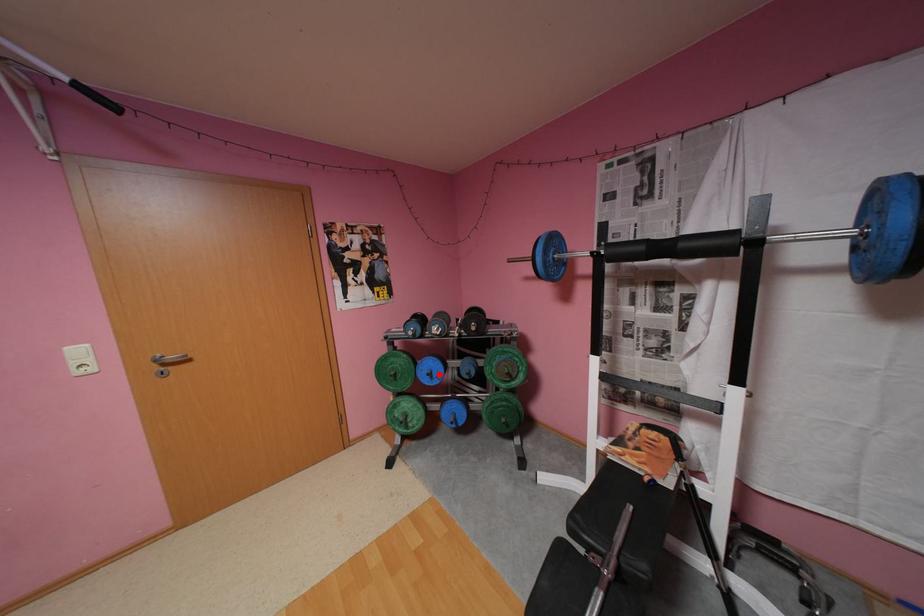
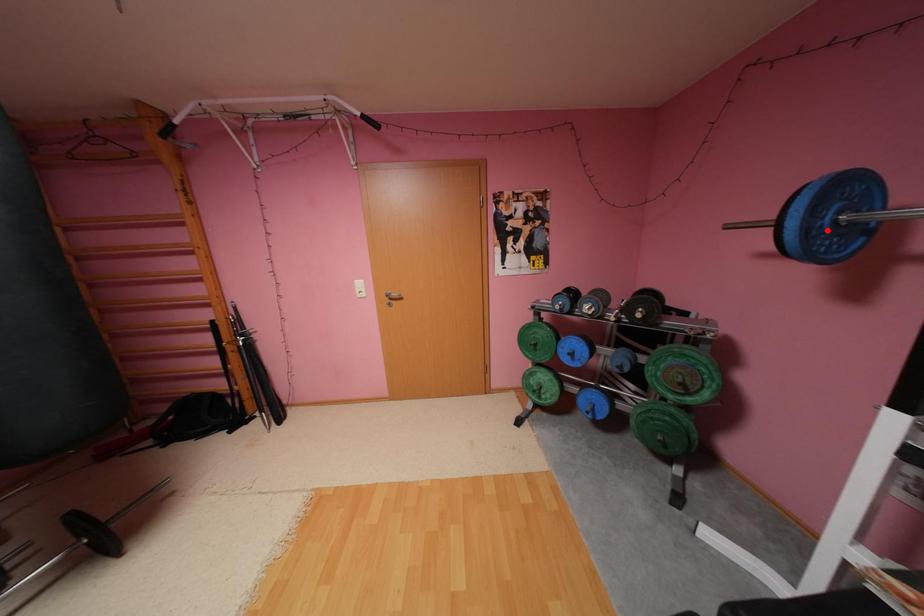
I am providing you with two images of the same scene from different viewpoints. A red point is marked on the first image and another point is marked on the second image. Are the points marked in image1 and image2 representing the same 3D position?

No